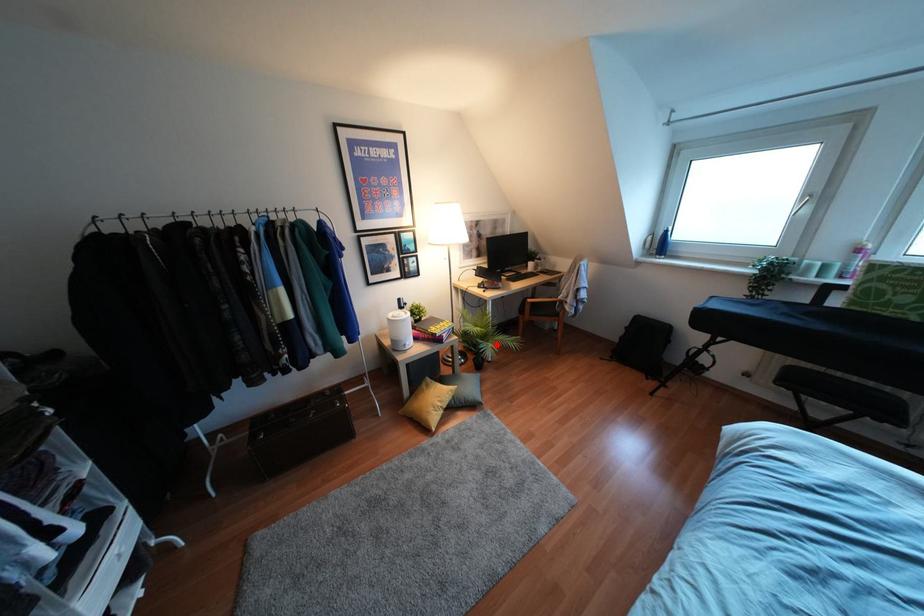
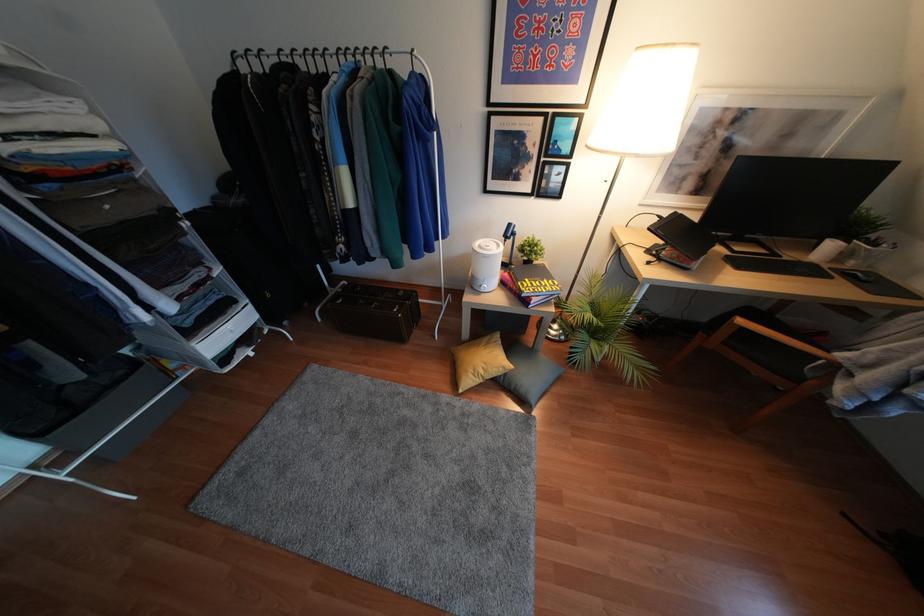
Question: I am providing you with two images of the same scene from different viewpoints. Image1 has a red point marked. In image2, the corresponding 3D location appears at what relative position? Reply with the corresponding letter.

Choices:
 (A) Closer
 (B) Farther

Answer: (A)